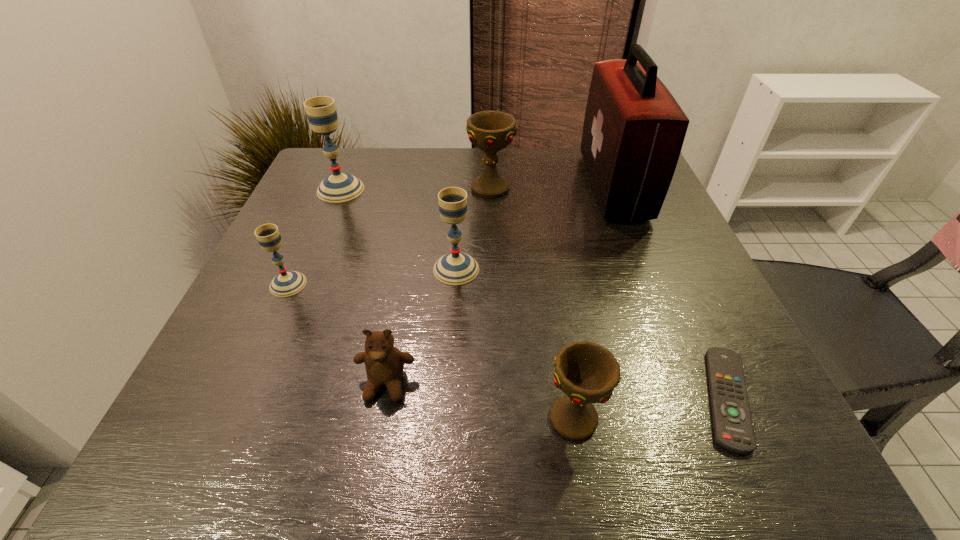
Where is `red first aid kit`? red first aid kit is located at coordinates pyautogui.click(x=634, y=129).

You are a GUI agent. You are given a task and a screenshot of the screen. Output one action in this format:
    pyautogui.click(x=<x>, y=<y>)
    Task: Click on the first aid kit
    This screenshot has width=960, height=540.
    Given the screenshot: What is the action you would take?
    pyautogui.click(x=634, y=129)

Where is `the biggest gray chalice`? The width and height of the screenshot is (960, 540). the biggest gray chalice is located at coordinates (321, 112).

Image resolution: width=960 pixels, height=540 pixels. Find the location of `the farthest gray chalice`. the farthest gray chalice is located at coordinates (321, 112).

Where is `the farther red chalice`? The width and height of the screenshot is (960, 540). the farther red chalice is located at coordinates (491, 131).

At what (x,y) coordinates should I click in order to perform the action: click on the left red chalice. Please return your answer as a coordinate pair (x, y). Looking at the image, I should click on (491, 131).

Image resolution: width=960 pixels, height=540 pixels. I want to click on the rightmost gray chalice, so click(455, 268).

Locate an element on the screen. The height and width of the screenshot is (540, 960). the smallest gray chalice is located at coordinates (287, 283).

This screenshot has width=960, height=540. Find the location of `the nearest chalice`. the nearest chalice is located at coordinates (587, 373).

At what (x,y) coordinates should I click in order to perform the action: click on the third object from right to left. Please return your answer as a coordinate pair (x, y). The height and width of the screenshot is (540, 960). Looking at the image, I should click on (587, 373).